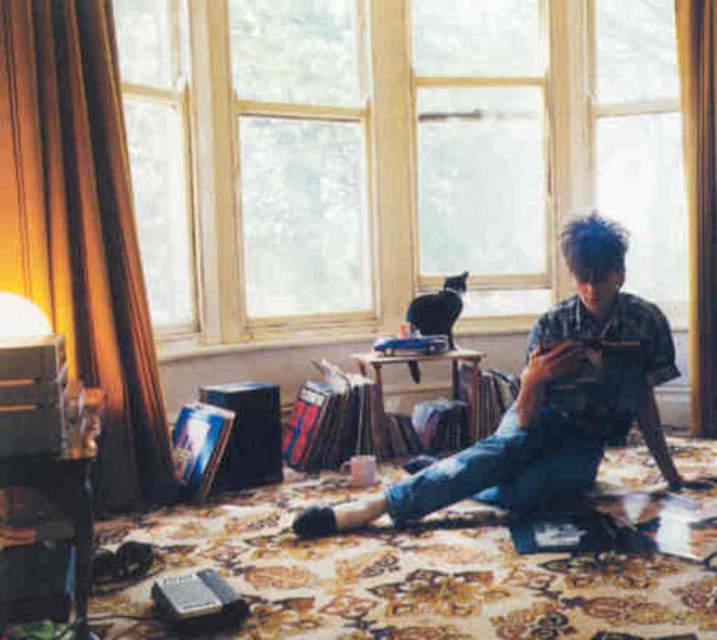
Is wooden frame at upper center further to camera compared to denim shirt at center?

Yes, wooden frame at upper center is further from the viewer.

Which is behind, point (137, 205) or point (518, 413)?

Positioned behind is point (137, 205).

Where is `wooden frame at upper center`? wooden frame at upper center is located at coordinates (394, 150).

Is point (242, 83) more distant than point (432, 333)?

Yes, it is behind point (432, 333).

Who is more forward, (404, 74) or (424, 296)?

Point (424, 296) is more forward.

The width and height of the screenshot is (717, 640). What do you see at coordinates (394, 150) in the screenshot?
I see `wooden frame at upper center` at bounding box center [394, 150].

This screenshot has width=717, height=640. I want to click on wooden frame at upper center, so click(x=394, y=150).

Is denim shirt at center below black fur cat at center?

Indeed, denim shirt at center is positioned under black fur cat at center.

Can you confirm if denim shirt at center is positioned to the left of black fur cat at center?

No, denim shirt at center is not to the left of black fur cat at center.

Which is behind, point (576, 444) or point (441, 314)?

The point (441, 314) is behind.

This screenshot has width=717, height=640. What are the coordinates of `denim shirt at center` in the screenshot? It's located at (550, 401).